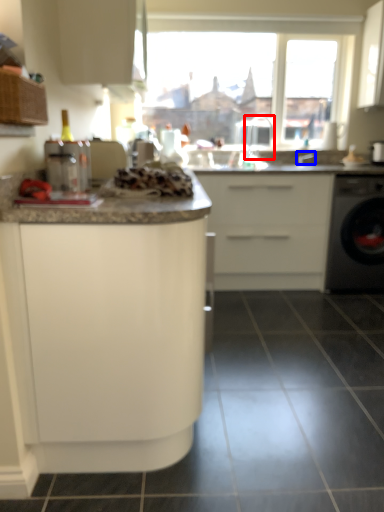
Question: Which point is further to the camera, faucet (highlighted by a red box) or faucet (highlighted by a blue box)?

Choices:
 (A) faucet
 (B) faucet

Answer: (B)